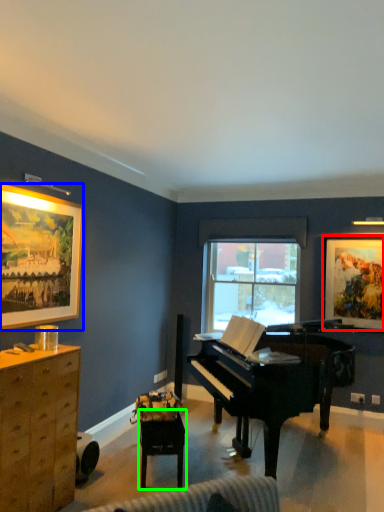
Question: Considering the real-world distances, which object is closest to picture frame (highlighted by a red box)? picture frame (highlighted by a blue box) or table (highlighted by a green box).

Choices:
 (A) picture frame
 (B) table

Answer: (B)